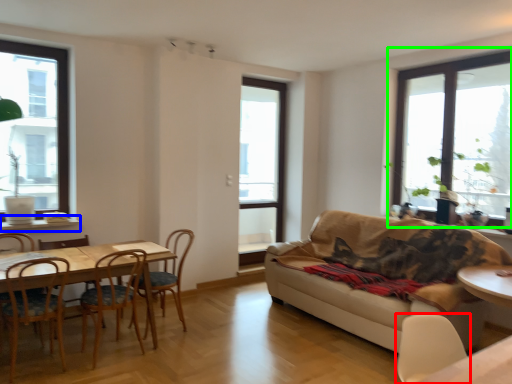
Question: Which object is positioned farthest from chair (highlighted by a red box)? Select from window sill (highlighted by a blue box) and window (highlighted by a green box).

Choices:
 (A) window sill
 (B) window

Answer: (A)